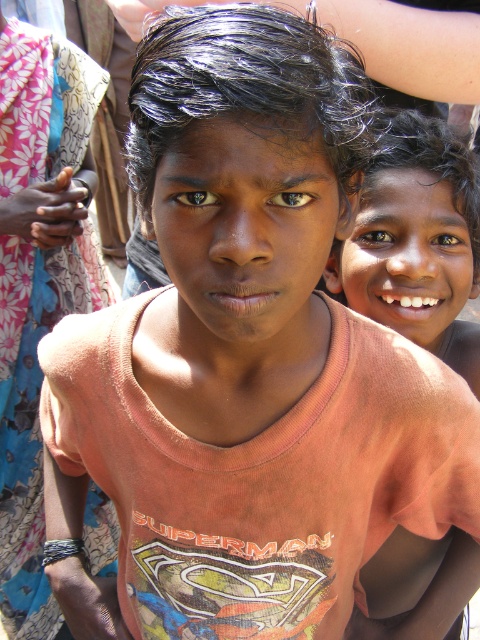
Is point (46, 228) positioned in front of point (459, 252)?

No, it is behind (459, 252).

I want to click on floral fabric sari at left, so click(38, 282).

Locate an element on the screen. floral fabric sari at left is located at coordinates (38, 282).